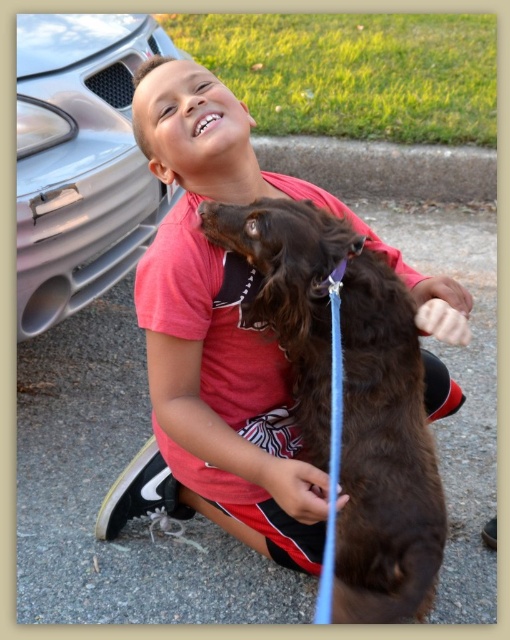
Question: Which of the following is the farthest from the observer?

Choices:
 (A) (287, 545)
 (B) (357, 468)

Answer: (A)

Question: Can you confirm if brown furry dog at center is thinner than silver metallic car at left?

Choices:
 (A) no
 (B) yes

Answer: (B)

Question: Is matte red shirt at center positioned in front of silver metallic car at left?

Choices:
 (A) no
 (B) yes

Answer: (B)

Question: Which point is farther to the camera?

Choices:
 (A) silver metallic car at left
 (B) brown furry dog at center

Answer: (A)

Question: Is matte red shirt at center below brown furry dog at center?

Choices:
 (A) yes
 (B) no

Answer: (B)

Question: Which of the following is the farthest from the observer?

Choices:
 (A) silver metallic car at left
 (B) matte red shirt at center

Answer: (A)